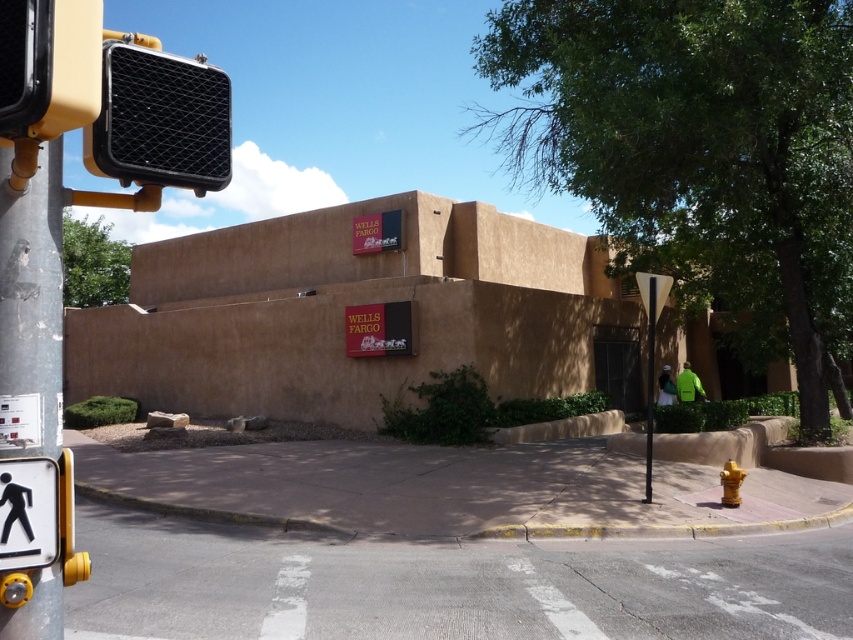
Question: Which of the following is the farthest from the observer?

Choices:
 (A) (38, 115)
 (B) (45, 488)

Answer: (B)

Question: Is black textured traffic light at upper left further to the viewer compared to metallic silver pole at center?

Choices:
 (A) yes
 (B) no

Answer: (B)

Question: Can you confirm if white plastic pedestrian sign at lower left is positioned below metallic silver street sign at center right?

Choices:
 (A) no
 (B) yes

Answer: (A)

Question: Estimate the real-world distances between objects in this image. Which object is closer to the metallic silver street sign at center right?

Choices:
 (A) metallic silver pole at center
 (B) white plastic pedestrian sign at lower left
 (C) yellow plastic traffic light at upper left

Answer: (A)

Question: Among these objects, which one is farthest from the camera?

Choices:
 (A) white plastic pedestrian sign at lower left
 (B) black textured traffic light at upper left
 (C) metallic silver street sign at center right
 (D) yellow plastic traffic light at upper left

Answer: (C)

Question: In this image, where is yellow plastic traffic light at upper left located relative to metallic silver pole at center?

Choices:
 (A) below
 (B) above

Answer: (B)